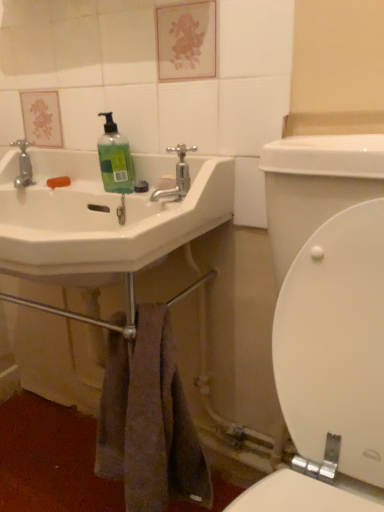
Question: From the image's perspective, is brown textured towel at lower center over green matte liquid soap at upper left?

Choices:
 (A) no
 (B) yes

Answer: (A)

Question: Does brown textured towel at lower center appear on the left side of green matte liquid soap at upper left?

Choices:
 (A) yes
 (B) no

Answer: (B)

Question: Considering the relative positions of brown textured towel at lower center and green matte liquid soap at upper left in the image provided, is brown textured towel at lower center behind green matte liquid soap at upper left?

Choices:
 (A) no
 (B) yes

Answer: (A)

Question: From a real-world perspective, is brown textured towel at lower center physically above green matte liquid soap at upper left?

Choices:
 (A) yes
 (B) no

Answer: (B)

Question: Is brown textured towel at lower center outside of green matte liquid soap at upper left?

Choices:
 (A) yes
 (B) no

Answer: (A)

Question: In the image, is white glossy sink at left positioned in front of or behind green matte liquid soap at upper left?

Choices:
 (A) behind
 (B) front

Answer: (B)

Question: Is white glossy sink at left taller or shorter than green matte liquid soap at upper left?

Choices:
 (A) short
 (B) tall

Answer: (B)

Question: Is white glossy sink at left to the left or to the right of green matte liquid soap at upper left in the image?

Choices:
 (A) right
 (B) left

Answer: (B)

Question: From the image's perspective, is white glossy sink at left above or below green matte liquid soap at upper left?

Choices:
 (A) above
 (B) below

Answer: (B)

Question: Considering the positions of polished chrome faucet at upper center and green matte liquid soap at upper left in the image, is polished chrome faucet at upper center taller or shorter than green matte liquid soap at upper left?

Choices:
 (A) short
 (B) tall

Answer: (A)

Question: Would you say polished chrome faucet at upper center is to the left or to the right of green matte liquid soap at upper left in the picture?

Choices:
 (A) left
 (B) right

Answer: (B)

Question: Is polished chrome faucet at upper center bigger or smaller than green matte liquid soap at upper left?

Choices:
 (A) small
 (B) big

Answer: (B)

Question: From a real-world perspective, is polished chrome faucet at upper center positioned above or below green matte liquid soap at upper left?

Choices:
 (A) above
 (B) below

Answer: (B)

Question: From a real-world perspective, is brown textured towel at lower center physically located above or below green matte liquid soap at upper left?

Choices:
 (A) below
 (B) above

Answer: (A)

Question: In the image, is brown textured towel at lower center positioned in front of or behind green matte liquid soap at upper left?

Choices:
 (A) behind
 (B) front

Answer: (B)